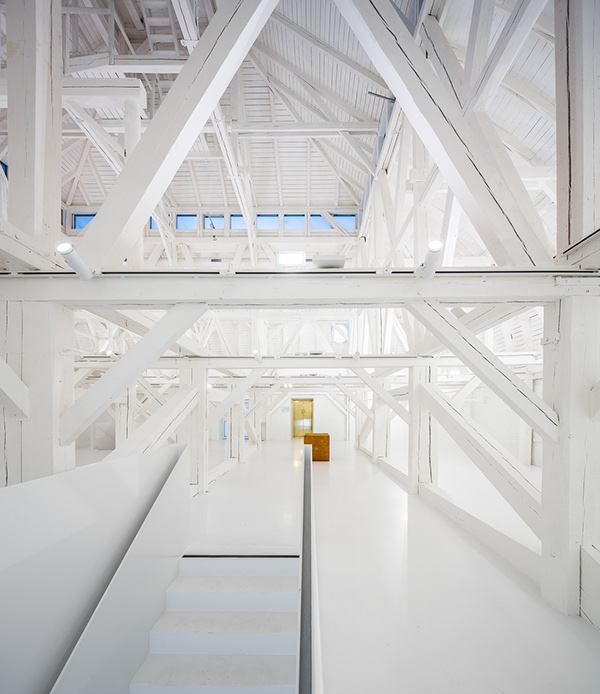
Find the location of `white beam`. white beam is located at coordinates (120, 375).